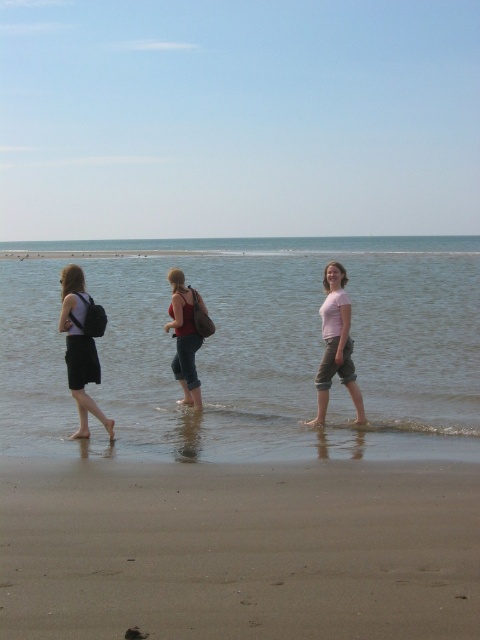
You are standing on the beach and see the matte black backpack at left and the matte black tank top at center. Which object is nearer to you?

The matte black backpack at left is closer to the viewer than the matte black tank top at center.

From the picture: You are standing on the beach and see the matte black backpack at left and the pink cotton shirt at center. Which object is closer to the ocean horizon?

The pink cotton shirt at center is closer to the ocean horizon because the matte black backpack at left is to the left of it, meaning the pink cotton shirt at center is positioned further right towards the horizon.

In the scene shown: You are standing on the beach and see the clear water at center and the matte black tank top at center. Which object is wider in the image?

The clear water at center is wider than the matte black tank top at center according to the description.